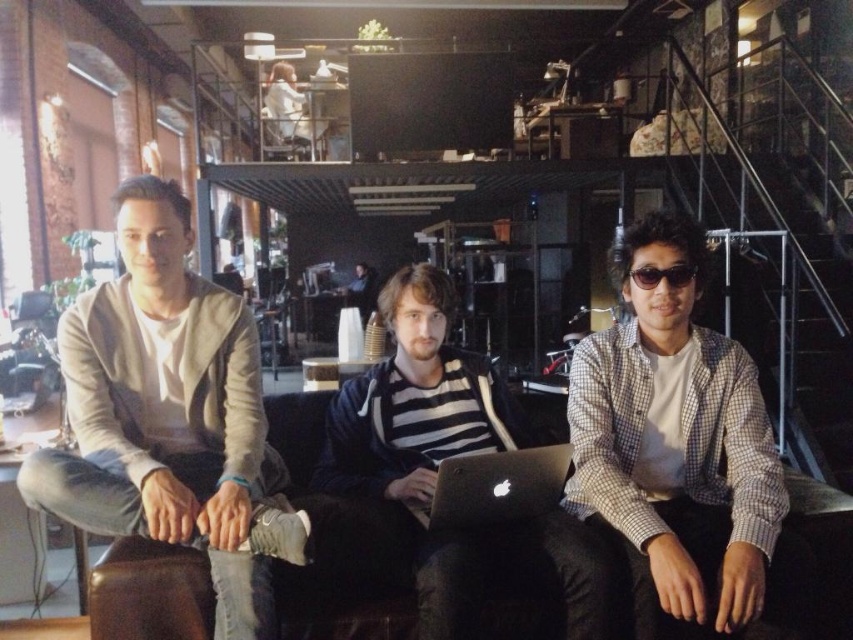
Based on the photo, is white checkered shirt at center shorter than striped fabric shirt at center?

No.

Find the location of a particular element. white checkered shirt at center is located at coordinates (675, 451).

Between silver metallic laptop at center and black plastic sunglasses at center, which one appears on the right side from the viewer's perspective?

From the viewer's perspective, black plastic sunglasses at center appears more on the right side.

Who is shorter, silver metallic laptop at center or black plastic sunglasses at center?

Standing shorter between the two is black plastic sunglasses at center.

This screenshot has height=640, width=853. Describe the element at coordinates (494, 486) in the screenshot. I see `silver metallic laptop at center` at that location.

What are the coordinates of `silver metallic laptop at center` in the screenshot? It's located at click(494, 486).

Which is more to the right, light beige sweater at center or striped fabric shirt at center?

light beige sweater at center is more to the right.

Which is behind, point (245, 410) or point (367, 310)?

Point (367, 310)

Is point (160, 378) farther from viewer compared to point (374, 285)?

No, it is in front of (374, 285).

Identify the location of light beige sweater at center. This screenshot has height=640, width=853. (170, 417).